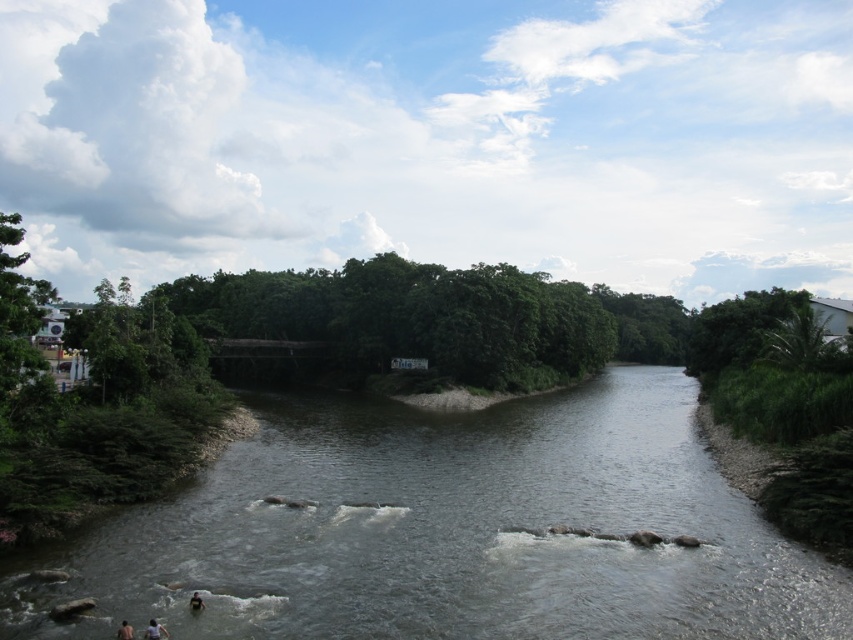
Which is above, skinny person at lower left or dark skin human at center?

skinny person at lower left is higher up.

Who is more forward, (131, 634) or (196, 608)?

Point (131, 634)

Where is `skinny person at lower left`? Image resolution: width=853 pixels, height=640 pixels. skinny person at lower left is located at coordinates (125, 630).

Does gray smooth river at center have a lesser width compared to white cotton shirt at lower left?

In fact, gray smooth river at center might be wider than white cotton shirt at lower left.

Is point (805, 608) positioned in front of point (149, 637)?

No, (805, 608) is behind (149, 637).

In order to click on gray smooth river at center in this screenshot , I will do `click(450, 531)`.

Which of these two, gray smooth river at center or dark skin human at center, stands taller?

With more height is gray smooth river at center.

I want to click on gray smooth river at center, so click(x=450, y=531).